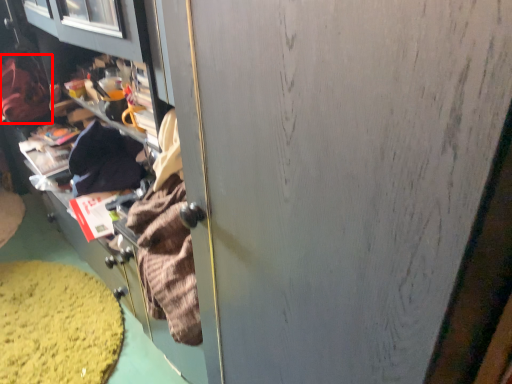
Question: From the image's perspective, where is clothing (annotated by the red box) located relative to debris?

Choices:
 (A) below
 (B) above

Answer: (B)